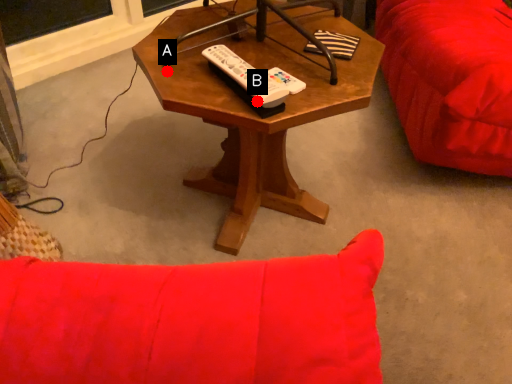
Question: Two points are circled on the image, labeled by A and B beside each circle. Which point is farther from the camera taking this photo?

Choices:
 (A) A is further
 (B) B is further

Answer: (A)